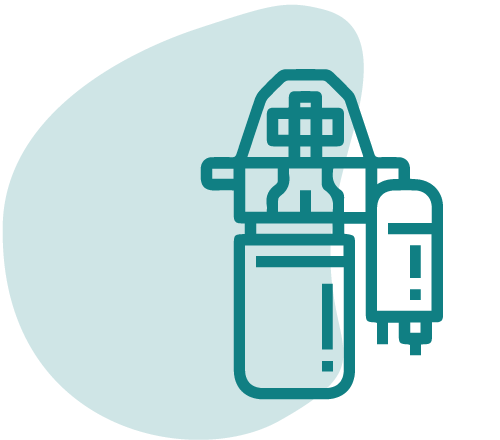
I want to click on plug, so click(x=406, y=260).